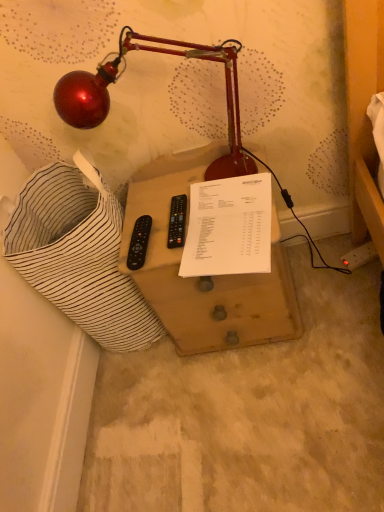
The image size is (384, 512). In order to click on vacant space to the right of black plastic remote at center, acting as the second control starting from the left in this screenshot , I will do `click(226, 216)`.